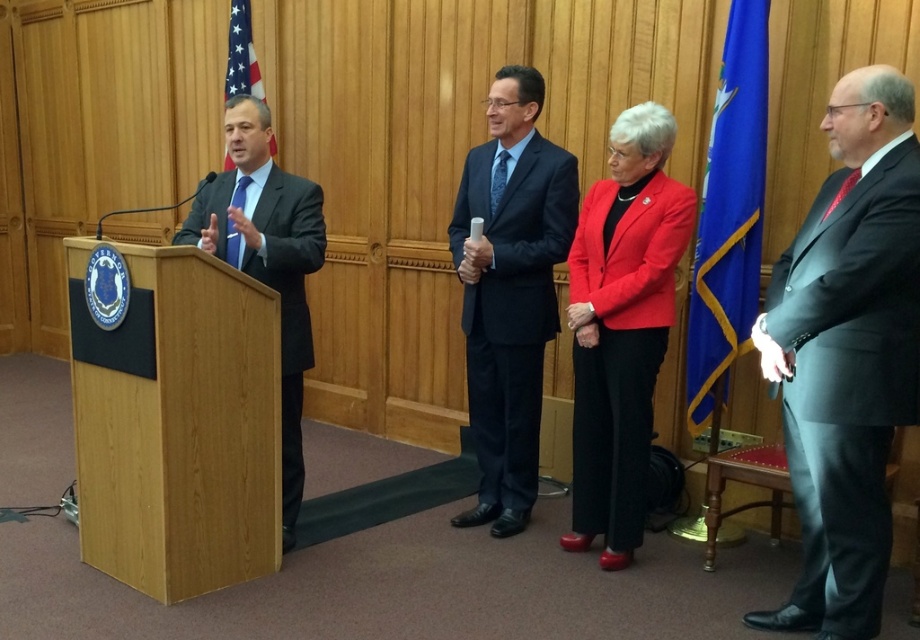
Question: Is dark blue suit at left wider than american flag at upper left?

Choices:
 (A) yes
 (B) no

Answer: (A)

Question: Among these objects, which one is farthest from the camera?

Choices:
 (A) american flag at upper left
 (B) dark gray suit at right

Answer: (A)

Question: Which point appears farthest from the camera in this image?

Choices:
 (A) (253, 67)
 (B) (286, 364)
 (C) (753, 304)
 (D) (641, 460)

Answer: (A)

Question: Does blue fabric flag at right have a larger size compared to dark blue textured suit at center?

Choices:
 (A) no
 (B) yes

Answer: (A)

Question: Can you confirm if matte red blazer at center is positioned above dark blue textured suit at center?

Choices:
 (A) no
 (B) yes

Answer: (A)

Question: Which object is the farthest from the dark blue suit at left?

Choices:
 (A) blue fabric flag at right
 (B) dark gray suit at right

Answer: (B)